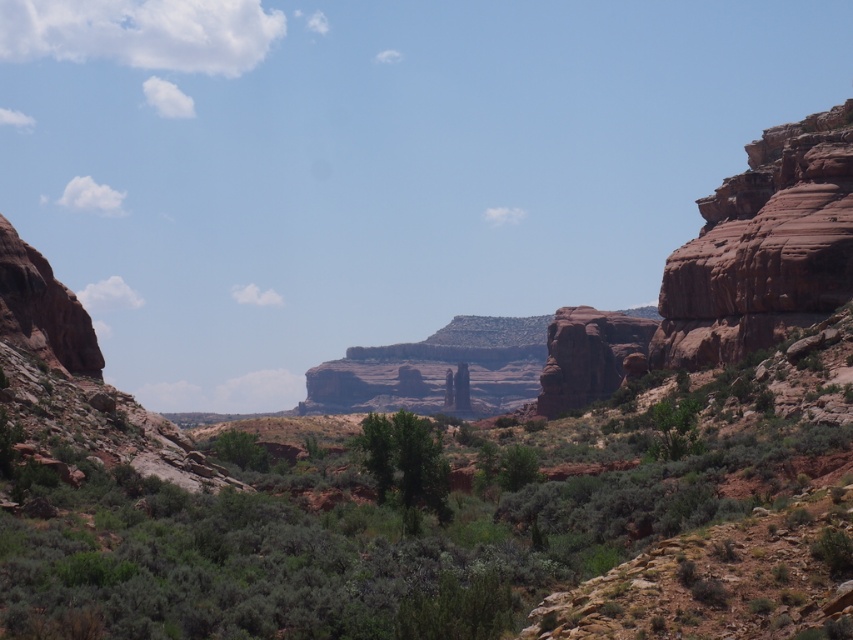
Question: Which point is farther to the camera?

Choices:
 (A) (850, 269)
 (B) (692, 408)
 (C) (567, 312)

Answer: (C)

Question: Can you confirm if green shrubbery at center is positioned to the left of green leafy tree at center?

Choices:
 (A) no
 (B) yes

Answer: (A)

Question: Which is farther from the rustic sandstone arch at center-right?

Choices:
 (A) green shrubbery at center
 (B) reddish-brown sedimentary rock at right

Answer: (A)

Question: Does green shrubbery at center appear on the left side of rustic sandstone arch at center-right?

Choices:
 (A) yes
 (B) no

Answer: (A)

Question: Is green shrubbery at center further to camera compared to green leafy tree at center?

Choices:
 (A) yes
 (B) no

Answer: (B)

Question: Considering the real-world distances, which object is closest to the green shrubbery at center?

Choices:
 (A) green leafy tree at center
 (B) reddish-brown sedimentary rock at right

Answer: (A)